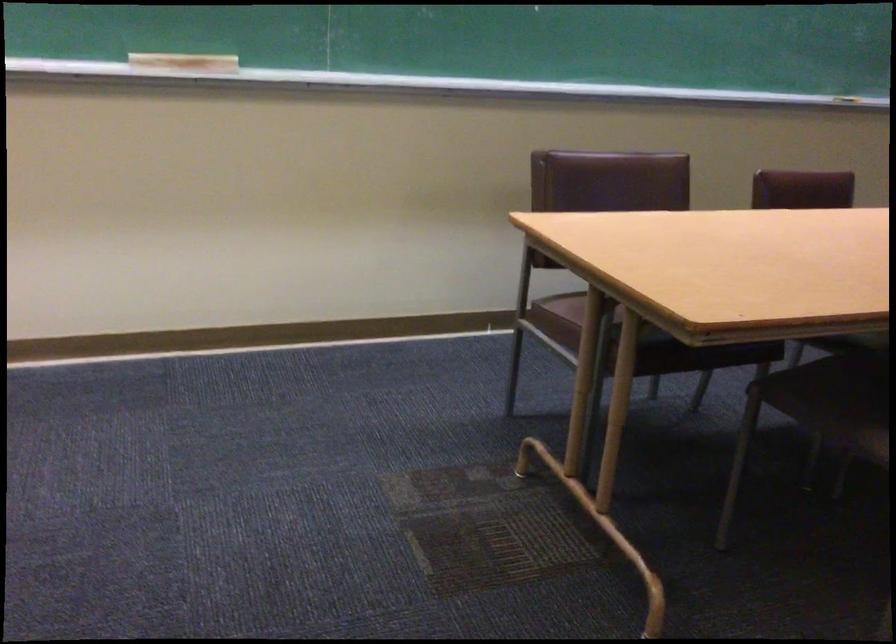
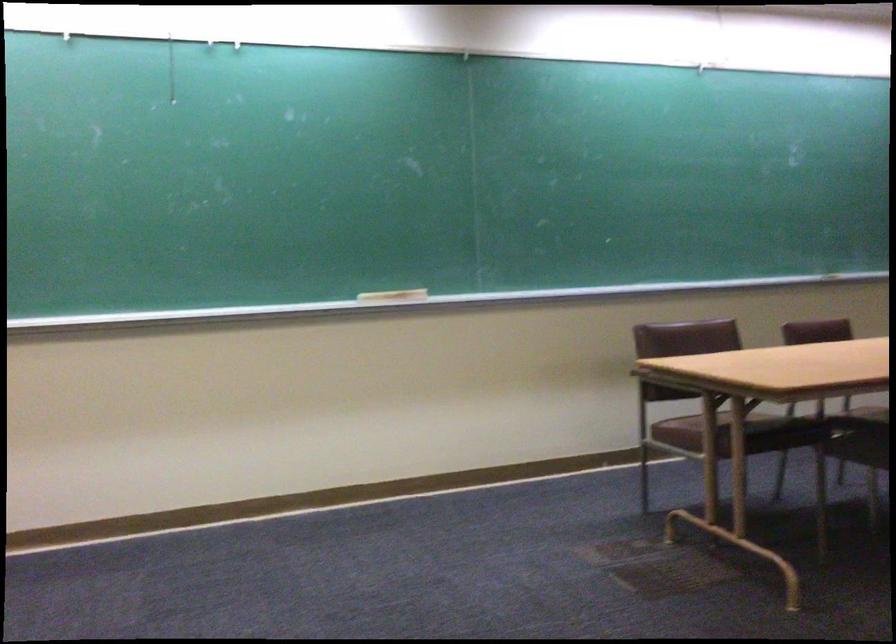
What movement of the cameraman would produce the second image?

The cameraman moved toward left, backward.